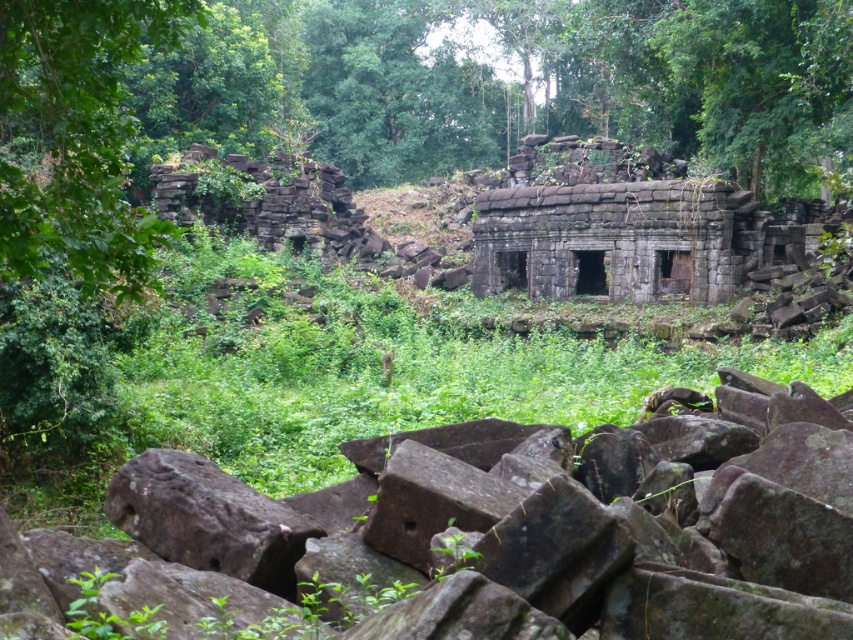
Question: Which of the following is the farthest from the observer?

Choices:
 (A) green leafy tree at left
 (B) gray rough stone at center

Answer: (A)

Question: Does gray rough stone at center have a lesser width compared to green leafy tree at left?

Choices:
 (A) yes
 (B) no

Answer: (B)

Question: Is gray rough stone at center below green leafy tree at left?

Choices:
 (A) yes
 (B) no

Answer: (A)

Question: Does gray rough stone at center appear under green leafy tree at left?

Choices:
 (A) yes
 (B) no

Answer: (A)